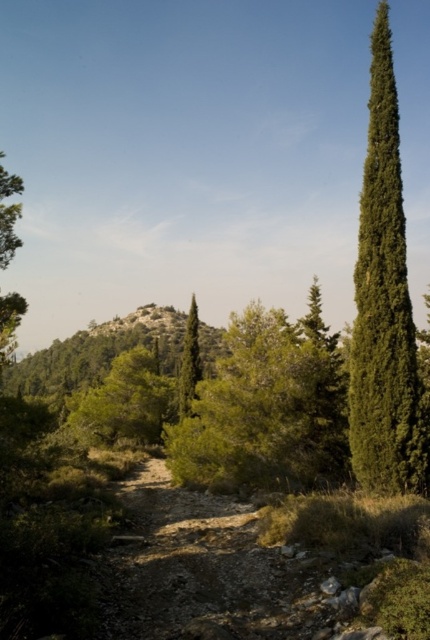
Question: In this image, where is dusty gravel trail at center located relative to green textured tree at right?

Choices:
 (A) left
 (B) right

Answer: (A)

Question: Considering the relative positions of green textured tree at right and green textured tree at center in the image provided, where is green textured tree at right located with respect to green textured tree at center?

Choices:
 (A) left
 (B) right

Answer: (B)

Question: Is green textured tree at right to the left of green textured tree at center from the viewer's perspective?

Choices:
 (A) yes
 (B) no

Answer: (B)

Question: Which object is positioned closest to the green textured tree at right?

Choices:
 (A) dusty gravel trail at center
 (B) green textured tree at center

Answer: (A)

Question: Which object is farther from the camera taking this photo?

Choices:
 (A) dusty gravel trail at center
 (B) green textured tree at right
 (C) green textured tree at center

Answer: (C)

Question: Which point is closer to the camera?

Choices:
 (A) dusty gravel trail at center
 (B) green textured tree at center

Answer: (A)